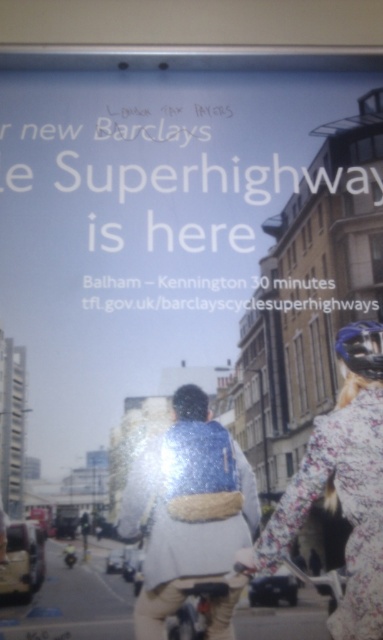
Does white paper poster at center appear under shiny blue jacket at center?

Actually, white paper poster at center is above shiny blue jacket at center.

Between white paper poster at center and shiny blue jacket at center, which one is positioned lower?

shiny blue jacket at center is below.

Who is more forward, (212, 248) or (202, 396)?

Positioned in front is point (202, 396).

You are a GUI agent. You are given a task and a screenshot of the screen. Output one action in this format:
    pyautogui.click(x=<x>, y=<y>)
    Task: Click on the white paper poster at center
    This screenshot has width=383, height=640.
    Given the screenshot: What is the action you would take?
    pyautogui.click(x=144, y=225)

Looking at this image, between white paper poster at center and floral fabric jacket at center, which one appears on the right side from the viewer's perspective?

From the viewer's perspective, floral fabric jacket at center appears more on the right side.

Is point (147, 368) less distant than point (309, 442)?

No, it is behind (309, 442).

Identify the location of white paper poster at center. (144, 225).

Is shiny blue jacket at center further to the viewer compared to floral fabric jacket at center?

Yes, it is behind floral fabric jacket at center.

Which is behind, point (234, 524) or point (274, 545)?

The point (234, 524) is behind.

At what (x,y) coordinates should I click in order to perform the action: click on shiny blue jacket at center. Please return your answer as a coordinate pair (x, y). Looking at the image, I should click on (189, 509).